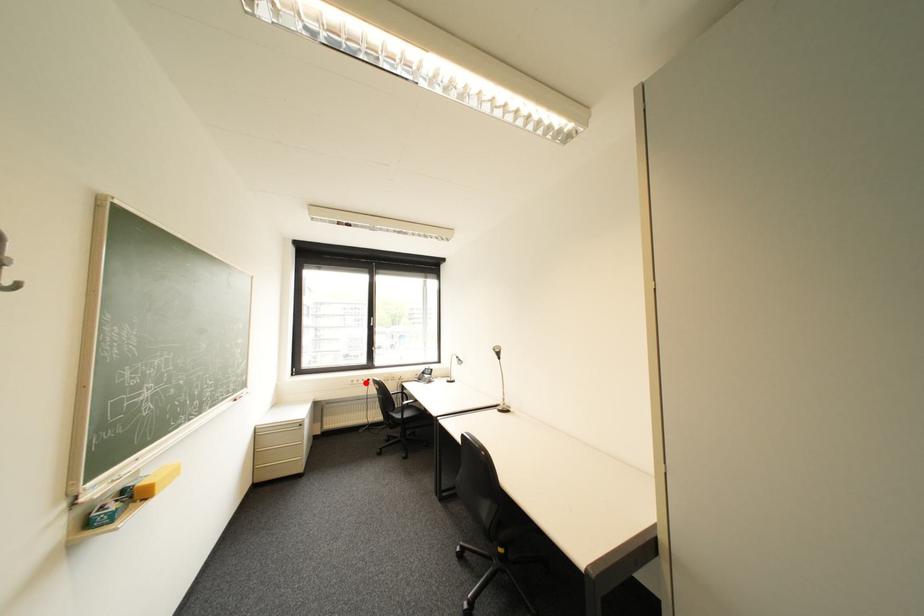
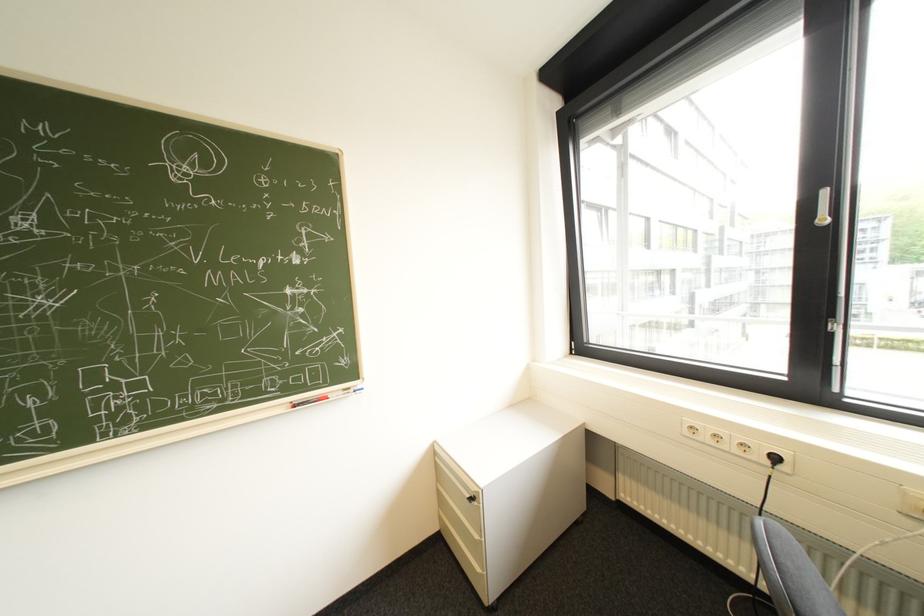
In the second image, find the point that corresponds to the highlighted location in the first image.

(715, 438)